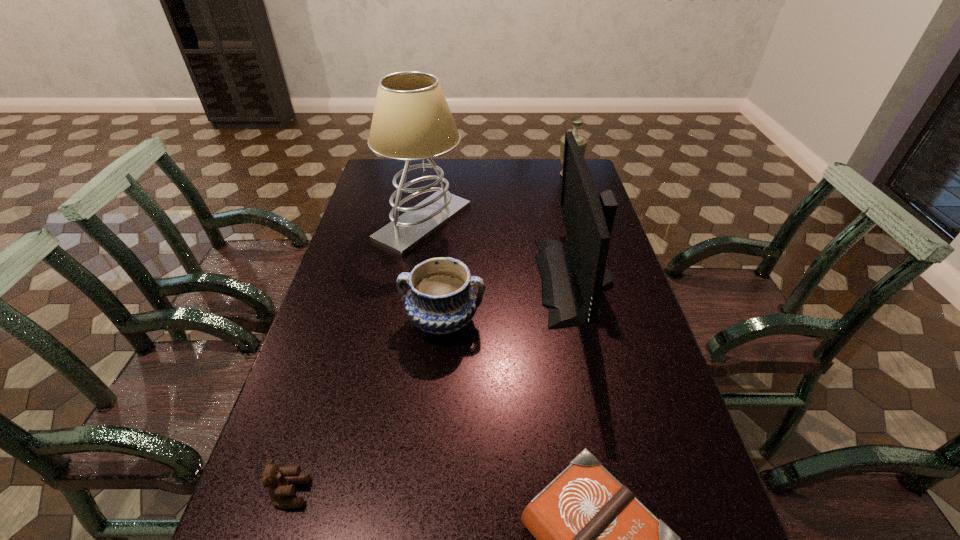
You are a GUI agent. You are given a task and a screenshot of the screen. Output one action in this format:
    pyautogui.click(x=<x>, y=<y>)
    Task: Click on the vacant position at the left edge of the desktop
    
    Given the screenshot: What is the action you would take?
    pyautogui.click(x=370, y=238)

At what (x,y) coordinates should I click in order to perform the action: click on vacant space at the right edge. Please return your answer as a coordinate pair (x, y). The image size is (960, 540). Looking at the image, I should click on (564, 230).

At what (x,y) coordinates should I click in order to perform the action: click on free point between the monitor and the third shortest object. Please return your answer as a coordinate pair (x, y). This screenshot has height=540, width=960. Looking at the image, I should click on (509, 300).

The height and width of the screenshot is (540, 960). I want to click on free space between the urn and the pottery, so click(506, 247).

Locate an element on the screen. The image size is (960, 540). free space between the fourth tallest object and the teddy bear is located at coordinates (367, 407).

Where is `free area in between the teddy bear and the table lamp`? This screenshot has height=540, width=960. free area in between the teddy bear and the table lamp is located at coordinates (357, 357).

This screenshot has width=960, height=540. Identify the location of unoccupied area between the teddy bear and the monitor. (433, 387).

Where is `the fifth closest object to the tallest object`? the fifth closest object to the tallest object is located at coordinates (280, 483).

Select which object appears as the fifth closest to the Bible. Please provide its 2D coordinates. Your answer should be formatted as a tuple, i.e. [(x, y)], where the tuple contains the x and y coordinates of a point satisfying the conditions above.

[(582, 141)]

Locate an element on the screen. The height and width of the screenshot is (540, 960). vacant area that satisfies the following two spatial constraints: 1. on the front side of the third tallest object; 2. on the screen side of the second tallest object is located at coordinates (601, 280).